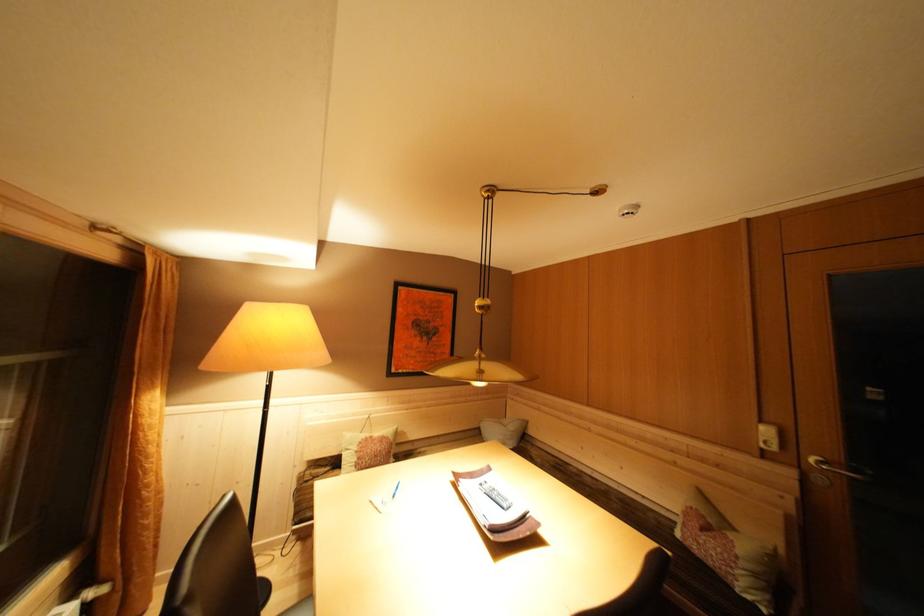
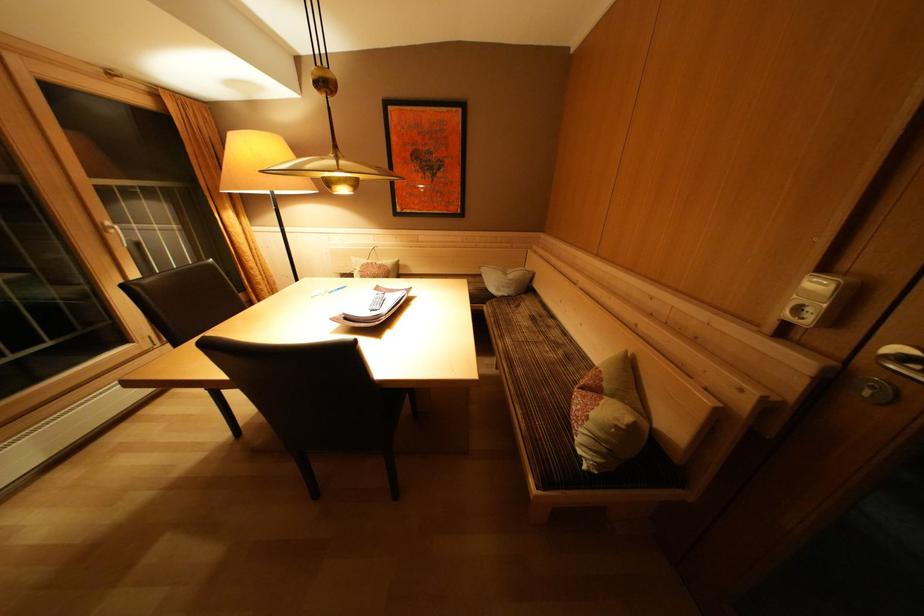
Find the pixel in the second image that matches point 378,442 in the first image.

(379, 268)